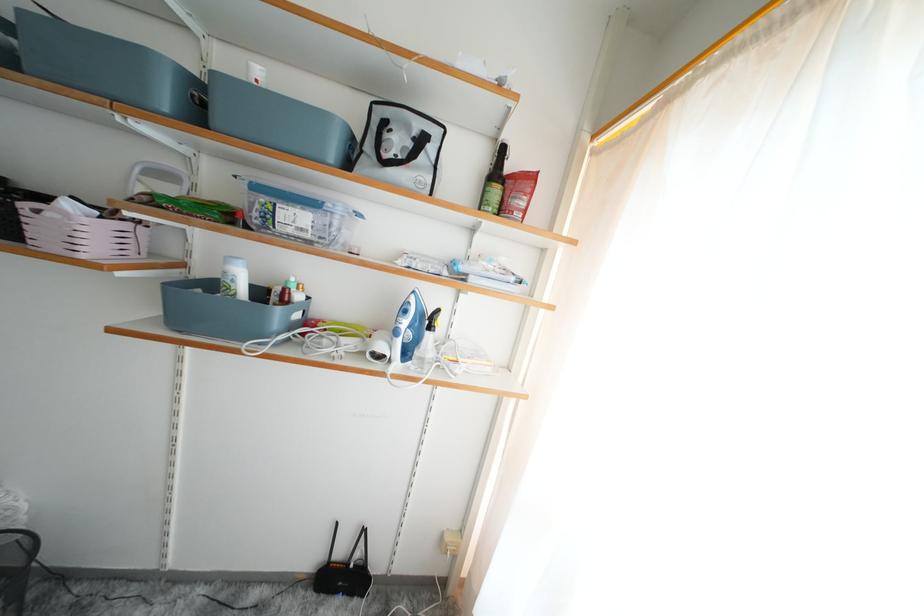
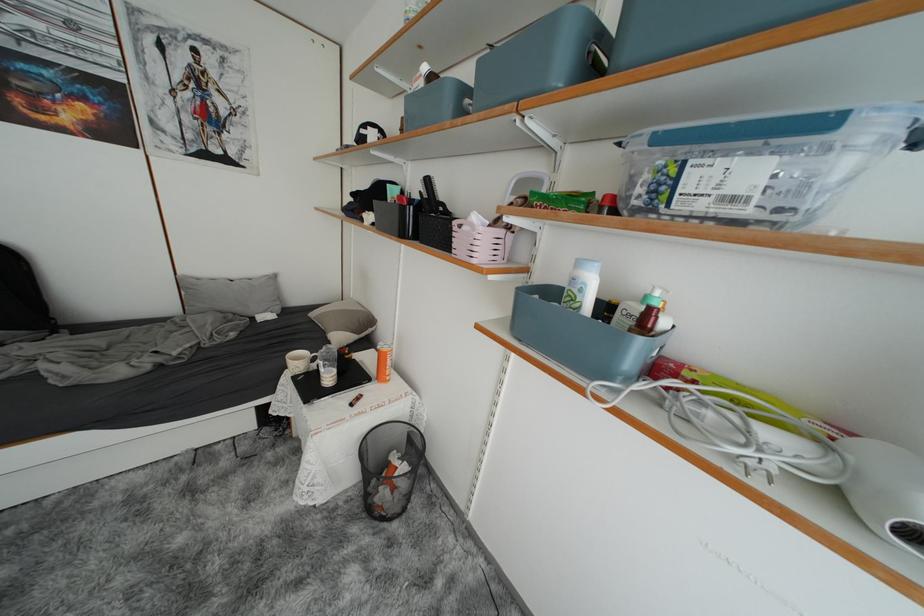
Question: Based on the continuous images, in which direction is the camera rotating? Reply with the corresponding letter.

Choices:
 (A) Left
 (B) Right
 (C) Up
 (D) Down

Answer: (A)